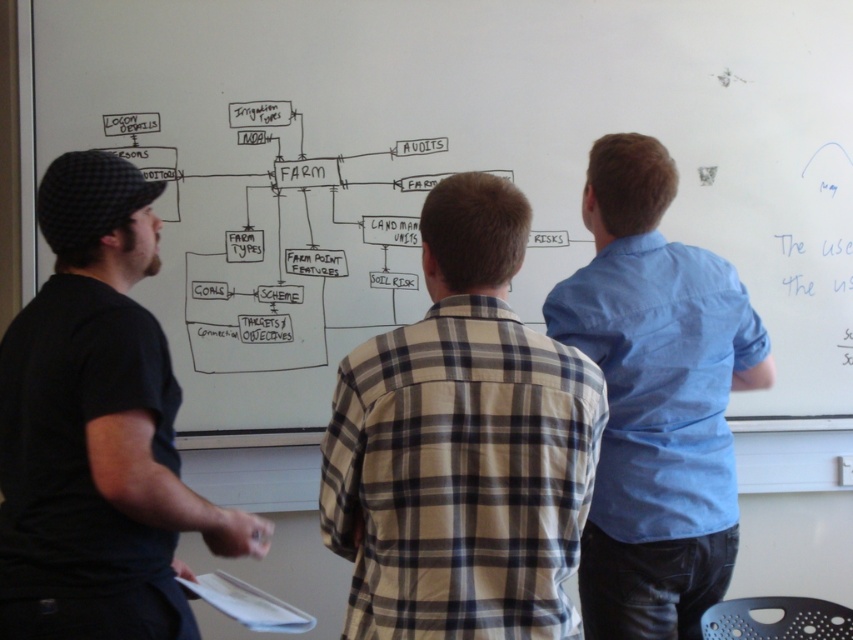
You are standing in front of the whiteboard and notice two points plotted on the diagram. The first point is at coordinates point (383, 368) and the second is at point (692, 392). Which point is closer to you?

Point (383, 368) is in front of point (692, 392), so it is closer to you.

You are observing a group of people in front of a whiteboard discussing farm management. There is a black cotton shirt at left and a light blue shirt at center. Which person is positioned more to the left?

The black cotton shirt at left is positioned more to the left than the light blue shirt at center.

You are standing in front of the whiteboard at upper center and the light blue shirt at center. Which object is wider?

The whiteboard at upper center is wider than the light blue shirt at center.